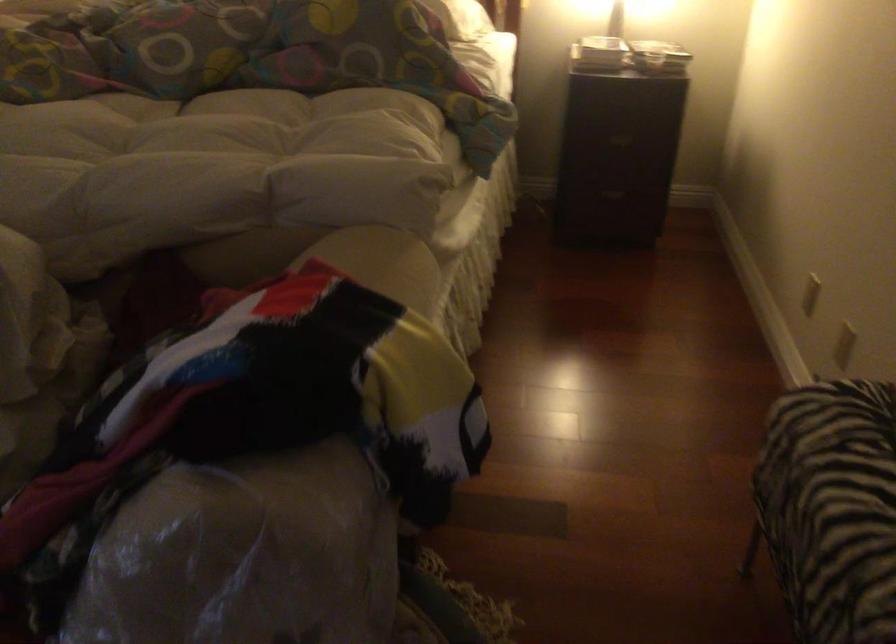
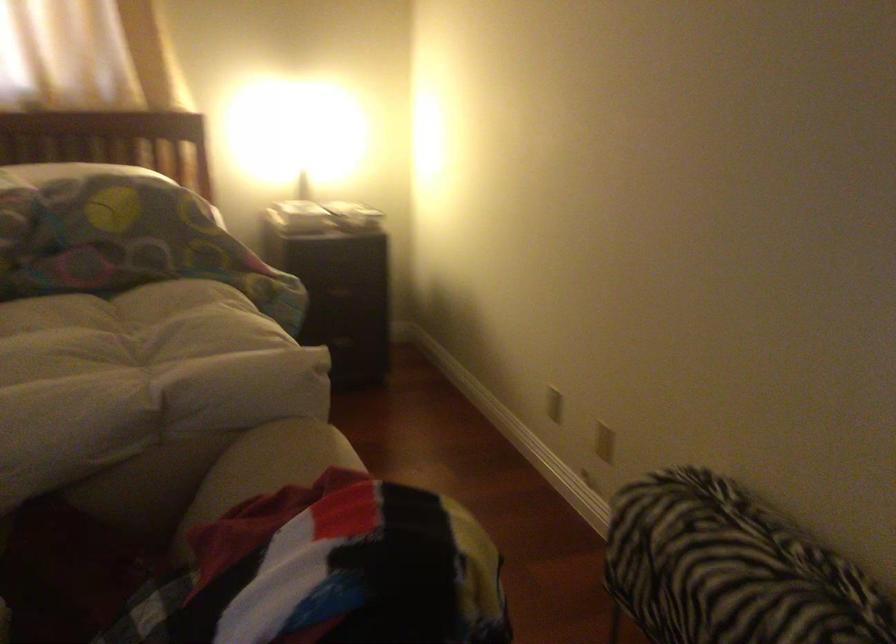
Question: How did the camera likely rotate?

Choices:
 (A) Left
 (B) Right
 (C) Up
 (D) Down

Answer: (B)